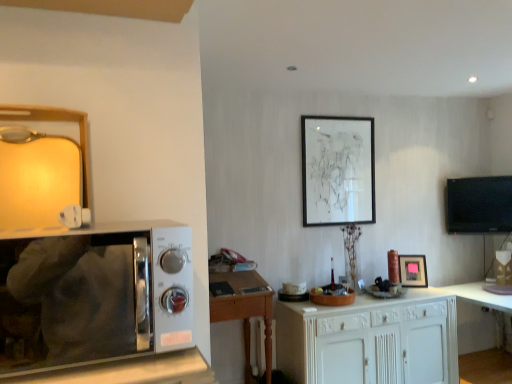
Question: Would you say white wood cabinet at center is outside matte black picture frame at center, the 1th picture frame when ordered from bottom to top?

Choices:
 (A) no
 (B) yes

Answer: (B)

Question: Is white wood cabinet at center far from matte black picture frame at center, the 1th picture frame when ordered from bottom to top?

Choices:
 (A) yes
 (B) no

Answer: (B)

Question: Does white wood cabinet at center have a lesser width compared to matte black picture frame at center, which is the 1th picture frame in right-to-left order?

Choices:
 (A) yes
 (B) no

Answer: (B)

Question: Is white wood cabinet at center surrounding matte black picture frame at center, the 1th picture frame when ordered from bottom to top?

Choices:
 (A) yes
 (B) no

Answer: (B)

Question: Can you confirm if white wood cabinet at center is positioned to the right of matte black picture frame at center, which is counted as the 2th picture frame, starting from the left?

Choices:
 (A) no
 (B) yes

Answer: (A)

Question: Considering the relative positions of black glossy tv at right and matte black picture frame at upper center, which is the 2th picture frame in right-to-left order, in the image provided, is black glossy tv at right to the left or to the right of matte black picture frame at upper center, which is the 2th picture frame in right-to-left order,?

Choices:
 (A) left
 (B) right

Answer: (B)

Question: Is black glossy tv at right in front of or behind matte black picture frame at upper center, which is counted as the 2th picture frame, starting from the bottom, in the image?

Choices:
 (A) front
 (B) behind

Answer: (B)

Question: From the image's perspective, is black glossy tv at right above or below matte black picture frame at upper center, which is counted as the 2th picture frame, starting from the bottom?

Choices:
 (A) above
 (B) below

Answer: (B)

Question: Choose the correct answer: Is black glossy tv at right inside matte black picture frame at upper center, which is the 2th picture frame in right-to-left order, or outside it?

Choices:
 (A) inside
 (B) outside

Answer: (B)

Question: Is wooden desk at center bigger or smaller than sleek silver microwave at left?

Choices:
 (A) small
 (B) big

Answer: (B)

Question: Is point (268, 299) positioned closer to the camera than point (138, 342)?

Choices:
 (A) farther
 (B) closer

Answer: (A)

Question: Is wooden desk at center situated inside sleek silver microwave at left or outside?

Choices:
 (A) inside
 (B) outside

Answer: (B)

Question: Is wooden desk at center in front of or behind sleek silver microwave at left in the image?

Choices:
 (A) behind
 (B) front

Answer: (A)

Question: Considering the positions of white wood cabinet at center and wooden desk at center in the image, is white wood cabinet at center wider or thinner than wooden desk at center?

Choices:
 (A) wide
 (B) thin

Answer: (A)

Question: From the image's perspective, relative to wooden desk at center, is white wood cabinet at center above or below?

Choices:
 (A) above
 (B) below

Answer: (B)